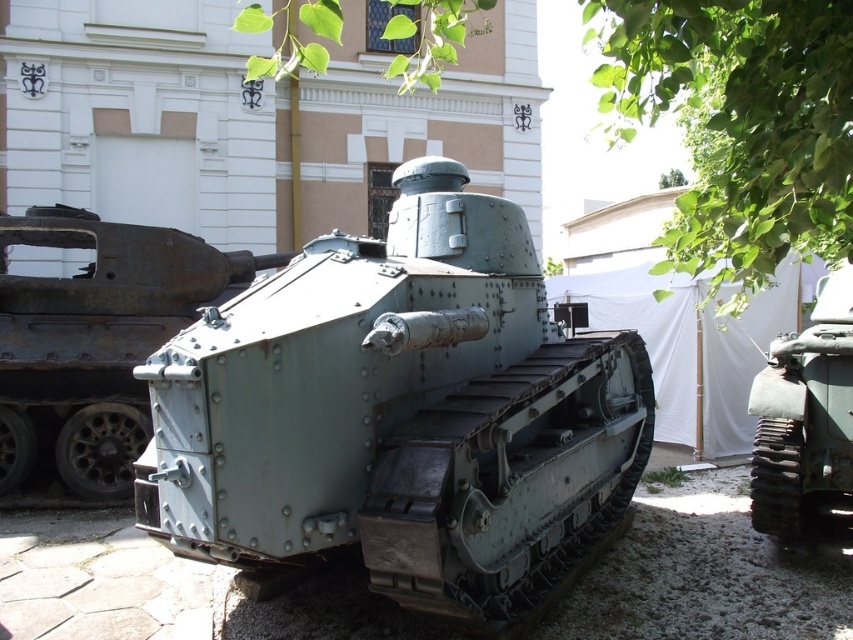
Between green leafy tree at upper center and rusty metal tank at center, which one has less height?

Standing shorter between the two is rusty metal tank at center.

At what (x,y) coordinates should I click in order to perform the action: click on green leafy tree at upper center. Please return your answer as a coordinate pair (x, y). The image size is (853, 640). Looking at the image, I should click on (738, 124).

Where is `green leafy tree at upper center`? green leafy tree at upper center is located at coordinates (738, 124).

Is matte green tank at center positioned in front of green matte tank at right?

Yes, it is in front of green matte tank at right.

Which is below, matte green tank at center or green matte tank at right?

matte green tank at center is below.

What do you see at coordinates (401, 417) in the screenshot? I see `matte green tank at center` at bounding box center [401, 417].

The width and height of the screenshot is (853, 640). Identify the location of matte green tank at center. (401, 417).

Does rusty metal tank at center have a larger size compared to green matte tank at right?

Yes, rusty metal tank at center is bigger than green matte tank at right.

I want to click on rusty metal tank at center, so click(x=96, y=337).

Find the location of a particular element. Image resolution: width=853 pixels, height=640 pixels. rusty metal tank at center is located at coordinates (96, 337).